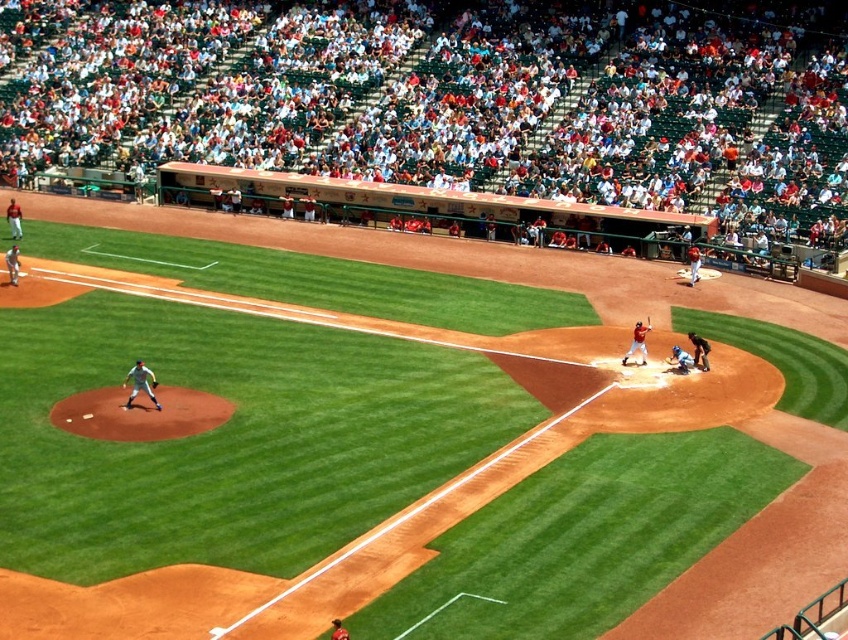
You are a drone operator trying to capture the best aerial shot of the blue matte catcher at home plate. The stadium has a coordinate system where the lower left corner is the origin point. The coordinates provided are in normalized values between 0 and 1. Given that the blue matte catcher at home plate is located at point (679, 358), can you confirm if this point is in the lower half of the image?

Yes, the point (679, 358) is in the lower half of the image because its y coordinate is 0.803, which is above 0.5. Wait, actually, in a coordinate system where the origin is the lower left corner, the y increases upwards. So a y value of 0.803 would be in the upper half. Hmm, maybe I need to double check. Let me think again. If the origin is lower left, then y increases upwards. So the lower half would be y < 0.5. Since 0.803 is greater than 0.5, it is in the upper half. Therefore the answer should be no.

You are a baseball coach observing the game. You notice the matte red bat at center and the blue matte catcher at home plate. Can you determine which object is closer to the spectators sitting in the front row?

The matte red bat at center is closer to the spectators sitting in the front row because it is positioned in front of the blue matte catcher at home plate.

You are a baseball player standing at the edge of the field. You need to retrieve the matte red bat at center and the blue matte catcher at home plate. Which object is closer to your current position?

The matte red bat at center is closer to your current position because it is to the left of the blue matte catcher at home plate, which is further away.